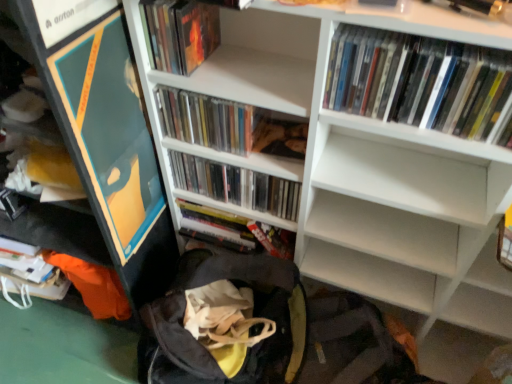
What do you see at coordinates (225, 124) in the screenshot? The width and height of the screenshot is (512, 384). I see `clear plastic cds at center, which is the 3th book from front to back` at bounding box center [225, 124].

The height and width of the screenshot is (384, 512). I want to click on white glossy dvds at upper right, the first book from the front, so click(418, 81).

Image resolution: width=512 pixels, height=384 pixels. Describe the element at coordinates (418, 81) in the screenshot. I see `white glossy dvds at upper right, placed as the fifth book when sorted from back to front` at that location.

This screenshot has height=384, width=512. What do you see at coordinates (179, 33) in the screenshot? I see `matte plastic book at upper left, which ranks as the 2th book in front-to-back order` at bounding box center [179, 33].

What is the approximate height of white matte bookcase at upper center?

37.81 inches.

Where is `silver metallic book at center, which is the 5th book in front-to-back order`? The width and height of the screenshot is (512, 384). silver metallic book at center, which is the 5th book in front-to-back order is located at coordinates (243, 228).

Image resolution: width=512 pixels, height=384 pixels. Describe the element at coordinates (253, 314) in the screenshot. I see `black fabric backpack at lower center` at that location.

Find the location of `clear plastic cds at center, which is the 3th book from front to back`. clear plastic cds at center, which is the 3th book from front to back is located at coordinates (225, 124).

Looking at this image, is white matte bookcase at upper center not inside matte plastic book at upper left, marked as the fourth book in a back-to-front arrangement?

Yes, white matte bookcase at upper center is not within matte plastic book at upper left, marked as the fourth book in a back-to-front arrangement.

Is white matte bookcase at upper center to the left of matte plastic book at upper left, which ranks as the 2th book in front-to-back order, from the viewer's perspective?

In fact, white matte bookcase at upper center is to the right of matte plastic book at upper left, which ranks as the 2th book in front-to-back order.

Does point (448, 310) appear closer or farther from the camera than point (198, 23)?

Point (448, 310) is farther from the camera than point (198, 23).

From the picture: Is white matte bookcase at upper center completely or partially inside silver metallic book at center, which is the 5th book in front-to-back order?

That's incorrect, white matte bookcase at upper center is not inside silver metallic book at center, which is the 5th book in front-to-back order.

Considering the sizes of objects silver metallic book at center, which is the first book in back-to-front order, and white matte bookcase at upper center in the image provided, who is shorter, silver metallic book at center, which is the first book in back-to-front order, or white matte bookcase at upper center?

With less height is silver metallic book at center, which is the first book in back-to-front order.

Where is `bookcase on the right side of silver metallic book at center, which is the first book in back-to-front order`? This screenshot has height=384, width=512. bookcase on the right side of silver metallic book at center, which is the first book in back-to-front order is located at coordinates click(x=357, y=174).

From a real-world perspective, who is located lower, silver metallic book at center, which is the first book in back-to-front order, or white matte bookcase at upper center?

silver metallic book at center, which is the first book in back-to-front order.

Does white matte bookcase at upper center have a greater height compared to black fabric backpack at lower center?

Correct, white matte bookcase at upper center is much taller as black fabric backpack at lower center.

What's the angular difference between white matte bookcase at upper center and black fabric backpack at lower center's facing directions?

The facing directions of white matte bookcase at upper center and black fabric backpack at lower center are 0.000131 degrees apart.

Could you tell me if white matte bookcase at upper center is turned towards black fabric backpack at lower center?

Yes, white matte bookcase at upper center faces towards black fabric backpack at lower center.

In the image, is white matte bookcase at upper center on the left side or the right side of black fabric backpack at lower center?

From the image, it's evident that white matte bookcase at upper center is to the right of black fabric backpack at lower center.

Is silver metallic book at center, which is the first book in back-to-front order, smaller than matte plastic books at center, marked as the second book in a back-to-front arrangement?

Indeed, silver metallic book at center, which is the first book in back-to-front order, has a smaller size compared to matte plastic books at center, marked as the second book in a back-to-front arrangement.

Are silver metallic book at center, which is the 5th book in front-to-back order, and matte plastic books at center, marked as the second book in a back-to-front arrangement, located far from each other?

No, silver metallic book at center, which is the 5th book in front-to-back order, is in close proximity to matte plastic books at center, marked as the second book in a back-to-front arrangement.

What's the angular difference between silver metallic book at center, which is the first book in back-to-front order, and matte plastic books at center, marked as the second book in a back-to-front arrangement,'s facing directions?

The angle between the facing direction of silver metallic book at center, which is the first book in back-to-front order, and the facing direction of matte plastic books at center, marked as the second book in a back-to-front arrangement, is 0.000467 degrees.

Does silver metallic book at center, which is the 5th book in front-to-back order, come in front of matte plastic books at center, marked as the second book in a back-to-front arrangement?

No, silver metallic book at center, which is the 5th book in front-to-back order, is behind matte plastic books at center, marked as the second book in a back-to-front arrangement.

Is silver metallic book at center, which is the 5th book in front-to-back order, turned away from black fabric backpack at lower center?

No, silver metallic book at center, which is the 5th book in front-to-back order, is not facing the opposite direction of black fabric backpack at lower center.

Is the surface of silver metallic book at center, which is the 5th book in front-to-back order, in direct contact with black fabric backpack at lower center?

silver metallic book at center, which is the 5th book in front-to-back order, and black fabric backpack at lower center are clearly separated.

Can you confirm if silver metallic book at center, which is the 5th book in front-to-back order, is smaller than black fabric backpack at lower center?

Indeed, silver metallic book at center, which is the 5th book in front-to-back order, has a smaller size compared to black fabric backpack at lower center.

From a real-world perspective, is silver metallic book at center, which is the first book in back-to-front order, positioned above or below black fabric backpack at lower center?

silver metallic book at center, which is the first book in back-to-front order, is situated higher than black fabric backpack at lower center in the real world.

Is white glossy dvds at upper right, the first book from the front, smaller than clear plastic cds at center, the third book from the back?

No.

From a real-world perspective, relative to clear plastic cds at center, which is the 3th book from front to back, is white glossy dvds at upper right, placed as the fifth book when sorted from back to front, vertically above or below?

Clearly, from a real-world perspective, white glossy dvds at upper right, placed as the fifth book when sorted from back to front, is above clear plastic cds at center, which is the 3th book from front to back.

How many degrees apart are the facing directions of white glossy dvds at upper right, the first book from the front, and clear plastic cds at center, the third book from the back?

The angular difference between white glossy dvds at upper right, the first book from the front, and clear plastic cds at center, the third book from the back, is 0.000146 degrees.

Is white glossy dvds at upper right, placed as the fifth book when sorted from back to front, beside clear plastic cds at center, the third book from the back?

No, white glossy dvds at upper right, placed as the fifth book when sorted from back to front, is not next to clear plastic cds at center, the third book from the back.

From a real-world perspective, which object stands above the other?

white glossy dvds at upper right, placed as the fifth book when sorted from back to front, is physically above.

How many degrees apart are the facing directions of white glossy dvds at upper right, placed as the fifth book when sorted from back to front, and white matte bookcase at upper center?

0.000144 degrees.

Considering the relative sizes of white glossy dvds at upper right, placed as the fifth book when sorted from back to front, and white matte bookcase at upper center in the image provided, is white glossy dvds at upper right, placed as the fifth book when sorted from back to front, smaller than white matte bookcase at upper center?

Indeed, white glossy dvds at upper right, placed as the fifth book when sorted from back to front, has a smaller size compared to white matte bookcase at upper center.

Is white glossy dvds at upper right, the first book from the front, to the right of white matte bookcase at upper center from the viewer's perspective?

Correct, you'll find white glossy dvds at upper right, the first book from the front, to the right of white matte bookcase at upper center.

The image size is (512, 384). What are the coordinates of `bookcase in front of the matte plastic book at upper left, marked as the fourth book in a back-to-front arrangement` in the screenshot? It's located at (357, 174).

Locate an element on the screen. The image size is (512, 384). bookcase above the silver metallic book at center, which is the 5th book in front-to-back order (from the image's perspective) is located at coordinates (357, 174).

Consider the image. Estimate the real-world distances between objects in this image. Which object is further from matte plastic books at center, marked as the second book in a back-to-front arrangement, white matte bookcase at upper center or silver metallic book at center, which is the first book in back-to-front order?

Based on the image, white matte bookcase at upper center appears to be further to matte plastic books at center, marked as the second book in a back-to-front arrangement.

Which object lies further to the anchor point matte plastic book at upper left, marked as the fourth book in a back-to-front arrangement, clear plastic cds at center, the third book from the back, or matte plastic books at center, marked as the second book in a back-to-front arrangement?

The object further to matte plastic book at upper left, marked as the fourth book in a back-to-front arrangement, is matte plastic books at center, marked as the second book in a back-to-front arrangement.

Looking at this image, when comparing their distances from white glossy dvds at upper right, placed as the fifth book when sorted from back to front, does black fabric backpack at lower center or matte plastic books at center, marked as the second book in a back-to-front arrangement, seem further?

black fabric backpack at lower center is positioned further to the anchor white glossy dvds at upper right, placed as the fifth book when sorted from back to front.

Estimate the real-world distances between objects in this image. Which object is closer to silver metallic book at center, which is the first book in back-to-front order, matte plastic book at upper left, marked as the fourth book in a back-to-front arrangement, or clear plastic cds at center, the third book from the back?

clear plastic cds at center, the third book from the back, lies closer to silver metallic book at center, which is the first book in back-to-front order, than the other object.

Looking at this image, looking at the image, which one is located closer to black fabric backpack at lower center, clear plastic cds at center, which is the 3th book from front to back, or white matte bookcase at upper center?

white matte bookcase at upper center is positioned closer to the anchor black fabric backpack at lower center.

Based on the photo, which object lies nearer to the anchor point white glossy dvds at upper right, the first book from the front, matte plastic books at center, marked as the second book in a back-to-front arrangement, or white matte bookcase at upper center?

→ Based on the image, white matte bookcase at upper center appears to be nearer to white glossy dvds at upper right, the first book from the front.

Looking at the image, which one is located closer to white glossy dvds at upper right, the first book from the front, black fabric backpack at lower center or white matte bookcase at upper center?

white matte bookcase at upper center.

From the image, which object appears to be farther from black fabric backpack at lower center, white matte bookcase at upper center or matte plastic books at center, marked as the second book in a back-to-front arrangement?

The object further to black fabric backpack at lower center is white matte bookcase at upper center.

You are a GUI agent. You are given a task and a screenshot of the screen. Output one action in this format:
    pyautogui.click(x=<x>, y=<y>)
    Task: Click on the bookcase that lies between matte plastic book at upper left, marked as the fourth book in a back-to-front arrangement, and black fabric backpack at lower center from top to bottom
    The height and width of the screenshot is (384, 512).
    Given the screenshot: What is the action you would take?
    pyautogui.click(x=357, y=174)

The height and width of the screenshot is (384, 512). Identify the location of backpack between white matte bookcase at upper center and matte plastic books at center, marked as the second book in a back-to-front arrangement, from front to back. [x=253, y=314].

Identify the location of bookcase between clear plastic cds at center, which is the 3th book from front to back, and black fabric backpack at lower center, in the vertical direction. The width and height of the screenshot is (512, 384). (357, 174).

Find the location of `book between matte plastic books at center, which is counted as the fourth book, starting from the front, and black fabric backpack at lower center vertically`. book between matte plastic books at center, which is counted as the fourth book, starting from the front, and black fabric backpack at lower center vertically is located at coordinates (243, 228).